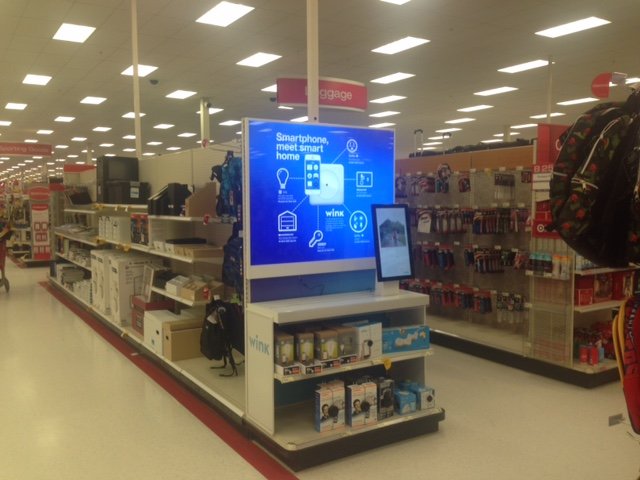
This screenshot has height=480, width=640. What are the coordinates of `floor` in the screenshot? It's located at (77, 391), (513, 422).